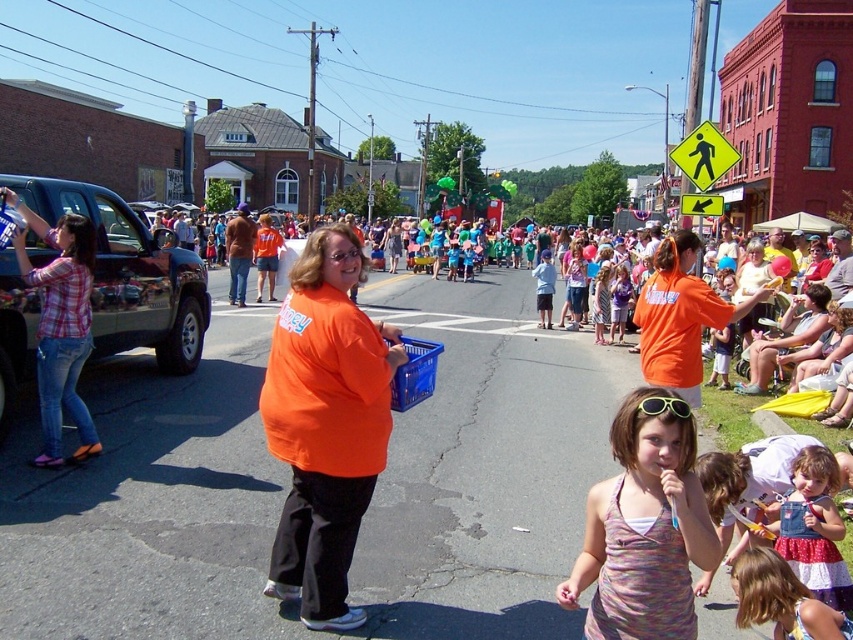
Question: Is printed cotton tank top at center to the right of plaid shirt at left from the viewer's perspective?

Choices:
 (A) yes
 (B) no

Answer: (A)

Question: Can you confirm if orange fabric shirt at center is positioned to the right of printed cotton tank top at center?

Choices:
 (A) no
 (B) yes

Answer: (A)

Question: Which object is closer to the camera taking this photo?

Choices:
 (A) denim dress at lower right
 (B) plaid shirt at left
 (C) orange fabric shirt at center
 (D) pastel striped dress at lower right

Answer: (D)

Question: Is orange fabric shirt at center smaller than orange matte shirt at center?

Choices:
 (A) no
 (B) yes

Answer: (A)

Question: Which point is closer to the camera?

Choices:
 (A) (65, 310)
 (B) (675, 328)
 (C) (601, 497)

Answer: (C)

Question: Which object is farther from the camera taking this photo?

Choices:
 (A) sunglasses at center
 (B) printed cotton tank top at center
 (C) orange fabric shirt at center
 (D) orange matte shirt at center

Answer: (D)